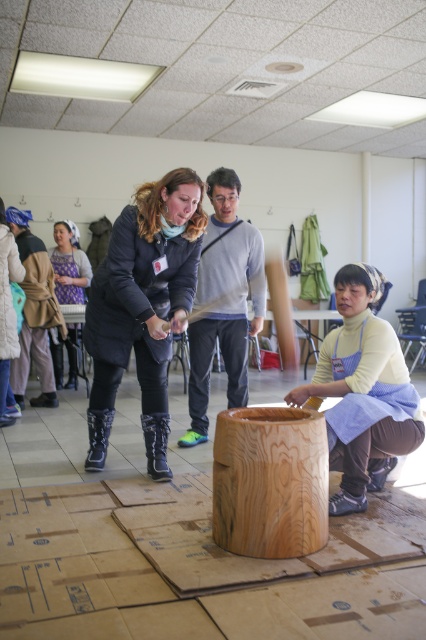
Question: Which of these objects is positioned closest to the natural wood cylinder at center?

Choices:
 (A) matte black jacket at center
 (B) matte black jacket at left

Answer: (A)

Question: Based on their relative distances, which object is farther from the matte black jacket at left?

Choices:
 (A) wooden bowl at lower center
 (B) natural wood cylinder at center
 (C) matte black jacket at center

Answer: (B)

Question: Is wooden bowl at lower center positioned in front of natural wood cylinder at center?

Choices:
 (A) yes
 (B) no

Answer: (B)

Question: Can you confirm if matte black jacket at center is smaller than wooden bowl at lower center?

Choices:
 (A) no
 (B) yes

Answer: (A)

Question: Can you confirm if natural wood cylinder at center is positioned to the left of matte black jacket at left?

Choices:
 (A) no
 (B) yes

Answer: (A)

Question: Which object is the farthest from the natural wood cylinder at center?

Choices:
 (A) matte black jacket at center
 (B) wooden bowl at lower center
 (C) matte black jacket at left

Answer: (C)